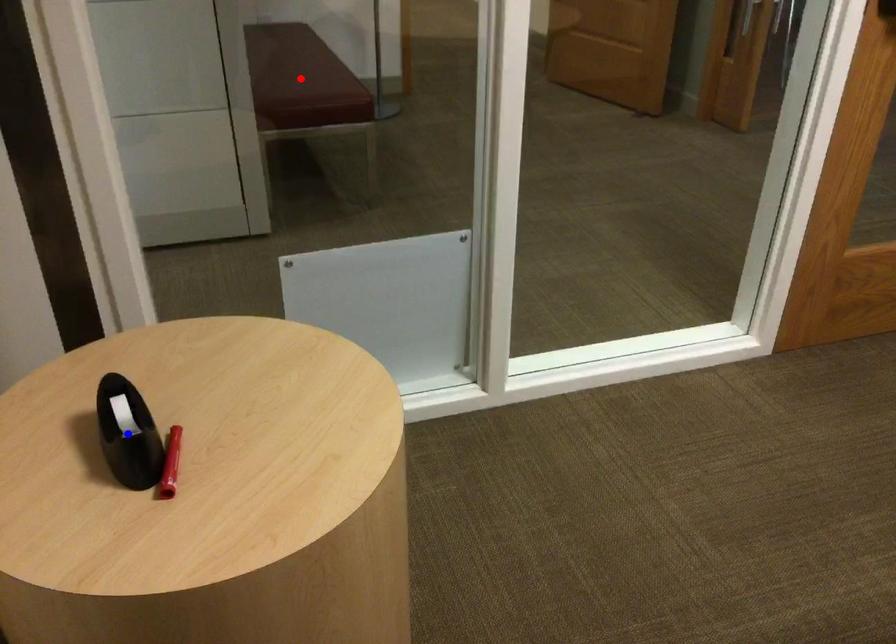
Question: Two points are marked on the image. Which point is closer to the camera?

Choices:
 (A) Blue point is closer.
 (B) Red point is closer.

Answer: (A)